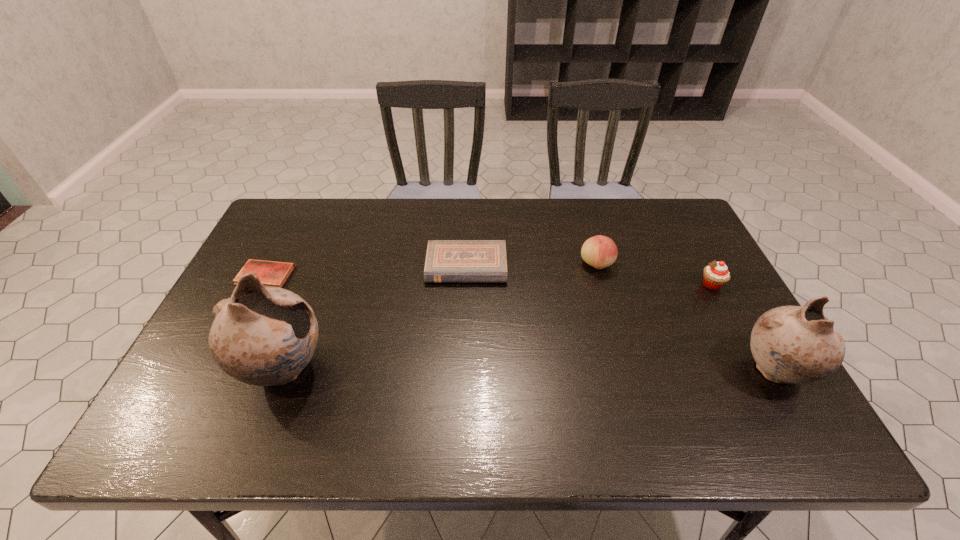
Where is `vacant position for inserting another pottery evenly`? This screenshot has width=960, height=540. vacant position for inserting another pottery evenly is located at coordinates (529, 370).